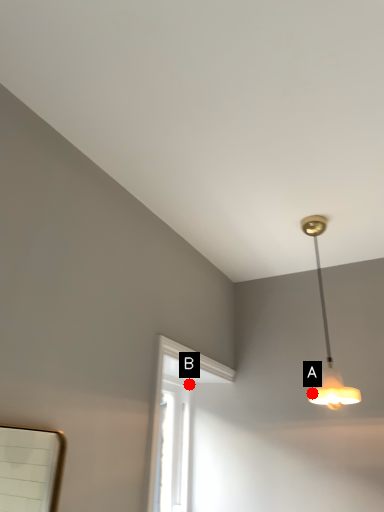
Question: Two points are circled on the image, labeled by A and B beside each circle. Which of the following is the farthest from the observer?

Choices:
 (A) A is further
 (B) B is further

Answer: (B)